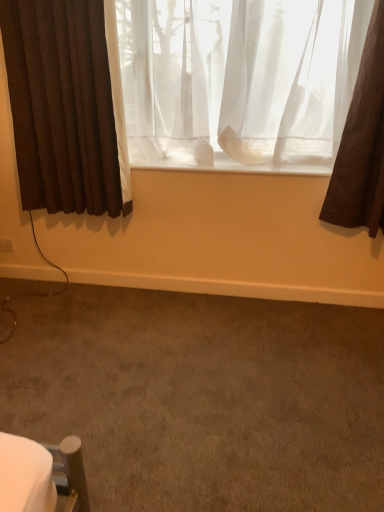
This screenshot has height=512, width=384. Describe the element at coordinates (237, 79) in the screenshot. I see `sheer white curtain at center, which is counted as the 1th curtain, starting from the right` at that location.

Describe the element at coordinates (6, 245) in the screenshot. I see `white plastic electric outlet at lower left` at that location.

You are a GUI agent. You are given a task and a screenshot of the screen. Output one action in this format:
    pyautogui.click(x=<x>, y=<y>)
    Task: Click on the brown carpet at lower center
    The height and width of the screenshot is (512, 384).
    Given the screenshot: What is the action you would take?
    pyautogui.click(x=203, y=398)

What do you see at coordinates (203, 398) in the screenshot? I see `brown carpet at lower center` at bounding box center [203, 398].

This screenshot has height=512, width=384. What are the coordinates of `sheer white curtain at center, placed as the second curtain when sorted from left to right` in the screenshot? It's located at (237, 79).

How different are the orientations of brown carpet at lower center and white plastic electric outlet at lower left in degrees?

The facing directions of brown carpet at lower center and white plastic electric outlet at lower left are 89.6 degrees apart.

Who is more distant, brown carpet at lower center or white plastic electric outlet at lower left?

white plastic electric outlet at lower left is more distant.

Which object is positioned more to the left, brown carpet at lower center or white plastic electric outlet at lower left?

Positioned to the left is white plastic electric outlet at lower left.

From the image's perspective, is brown carpet at lower center located above or below white plastic electric outlet at lower left?

brown carpet at lower center is situated lower than white plastic electric outlet at lower left in the image.

Who is taller, sheer white curtain at center, which is counted as the 1th curtain, starting from the right, or brown carpet at lower center?

sheer white curtain at center, which is counted as the 1th curtain, starting from the right, is taller.

Can we say sheer white curtain at center, which is counted as the 1th curtain, starting from the right, lies outside brown carpet at lower center?

Yes.

Between sheer white curtain at center, which is counted as the 1th curtain, starting from the right, and brown carpet at lower center, which one has larger width?

brown carpet at lower center.

Is brown fabric curtain at left, marked as the 2th curtain in a right-to-left arrangement, smaller than brown carpet at lower center?

Yes, brown fabric curtain at left, marked as the 2th curtain in a right-to-left arrangement, is smaller than brown carpet at lower center.

From the image's perspective, who appears lower, brown fabric curtain at left, arranged as the first curtain when viewed from the left, or brown carpet at lower center?

brown carpet at lower center.

Is brown fabric curtain at left, marked as the 2th curtain in a right-to-left arrangement, aimed at brown carpet at lower center?

No, brown fabric curtain at left, marked as the 2th curtain in a right-to-left arrangement, is not aimed at brown carpet at lower center.

How far apart are brown fabric curtain at left, marked as the 2th curtain in a right-to-left arrangement, and brown carpet at lower center?

A distance of 3.66 feet exists between brown fabric curtain at left, marked as the 2th curtain in a right-to-left arrangement, and brown carpet at lower center.

Is brown fabric curtain at left, marked as the 2th curtain in a right-to-left arrangement, far away from white plastic electric outlet at lower left?

Actually, brown fabric curtain at left, marked as the 2th curtain in a right-to-left arrangement, and white plastic electric outlet at lower left are a little close together.

I want to click on electric outlet located behind the brown fabric curtain at left, arranged as the first curtain when viewed from the left, so click(x=6, y=245).

From a real-world perspective, which is physically below, brown fabric curtain at left, arranged as the first curtain when viewed from the left, or white plastic electric outlet at lower left?

In real-world perspective, white plastic electric outlet at lower left is lower.

From the image's perspective, which one is positioned higher, brown fabric curtain at left, arranged as the first curtain when viewed from the left, or white plastic electric outlet at lower left?

brown fabric curtain at left, arranged as the first curtain when viewed from the left, from the image's perspective.

At what (x,y) coordinates should I click in order to perform the action: click on curtain behind the sheer white curtain at center, placed as the second curtain when sorted from left to right. Please return your answer as a coordinate pair (x, y). The image size is (384, 512). Looking at the image, I should click on (62, 106).

Which is more to the left, sheer white curtain at center, placed as the second curtain when sorted from left to right, or brown fabric curtain at left, arranged as the first curtain when viewed from the left?

Positioned to the left is brown fabric curtain at left, arranged as the first curtain when viewed from the left.

Considering the relative positions of sheer white curtain at center, which is counted as the 1th curtain, starting from the right, and brown fabric curtain at left, arranged as the first curtain when viewed from the left, in the image provided, is sheer white curtain at center, which is counted as the 1th curtain, starting from the right, in front of brown fabric curtain at left, arranged as the first curtain when viewed from the left,?

Yes, the depth of sheer white curtain at center, which is counted as the 1th curtain, starting from the right, is less than that of brown fabric curtain at left, arranged as the first curtain when viewed from the left.

From a real-world perspective, is sheer white curtain at center, which is counted as the 1th curtain, starting from the right, on top of brown fabric curtain at left, marked as the 2th curtain in a right-to-left arrangement?

Yes, from a real-world perspective, sheer white curtain at center, which is counted as the 1th curtain, starting from the right, is over brown fabric curtain at left, marked as the 2th curtain in a right-to-left arrangement

From the image's perspective, is white plastic electric outlet at lower left located above or below brown carpet at lower center?

From the image's perspective, white plastic electric outlet at lower left appears above brown carpet at lower center.

Would you say white plastic electric outlet at lower left is outside brown carpet at lower center?

white plastic electric outlet at lower left is positioned outside brown carpet at lower center.

Is white plastic electric outlet at lower left with brown carpet at lower center?

No, white plastic electric outlet at lower left is not next to brown carpet at lower center.

Relative to brown carpet at lower center, is white plastic electric outlet at lower left in front or behind?

Visually, white plastic electric outlet at lower left is located behind brown carpet at lower center.

Is brown fabric curtain at left, arranged as the first curtain when viewed from the left, inside white plastic electric outlet at lower left?

Definitely not — brown fabric curtain at left, arranged as the first curtain when viewed from the left, is not inside white plastic electric outlet at lower left.

Considering the relative positions of white plastic electric outlet at lower left and brown fabric curtain at left, arranged as the first curtain when viewed from the left, in the image provided, is white plastic electric outlet at lower left to the left or to the right of brown fabric curtain at left, arranged as the first curtain when viewed from the left,?

In the image, white plastic electric outlet at lower left appears on the left side of brown fabric curtain at left, arranged as the first curtain when viewed from the left.

Between white plastic electric outlet at lower left and brown fabric curtain at left, marked as the 2th curtain in a right-to-left arrangement, which one has smaller size?

With smaller size is white plastic electric outlet at lower left.

In order to click on electric outlet on the left of the brown carpet at lower center in this screenshot , I will do `click(6, 245)`.

Where is `plain below the sheer white curtain at center, placed as the second curtain when sorted from left to right (from the image's perspective)`? plain below the sheer white curtain at center, placed as the second curtain when sorted from left to right (from the image's perspective) is located at coordinates (203, 398).

From the picture: From the image, which object appears to be nearer to brown fabric curtain at left, marked as the 2th curtain in a right-to-left arrangement, sheer white curtain at center, which is counted as the 1th curtain, starting from the right, or white plastic electric outlet at lower left?

sheer white curtain at center, which is counted as the 1th curtain, starting from the right, lies closer to brown fabric curtain at left, marked as the 2th curtain in a right-to-left arrangement, than the other object.

Estimate the real-world distances between objects in this image. Which object is further from white plastic electric outlet at lower left, sheer white curtain at center, placed as the second curtain when sorted from left to right, or brown fabric curtain at left, marked as the 2th curtain in a right-to-left arrangement?

Based on the image, sheer white curtain at center, placed as the second curtain when sorted from left to right, appears to be further to white plastic electric outlet at lower left.

When comparing their distances from sheer white curtain at center, placed as the second curtain when sorted from left to right, does brown fabric curtain at left, marked as the 2th curtain in a right-to-left arrangement, or brown carpet at lower center seem closer?

Based on the image, brown fabric curtain at left, marked as the 2th curtain in a right-to-left arrangement, appears to be nearer to sheer white curtain at center, placed as the second curtain when sorted from left to right.

Consider the image. When comparing their distances from white plastic electric outlet at lower left, does brown carpet at lower center or sheer white curtain at center, placed as the second curtain when sorted from left to right, seem further?

sheer white curtain at center, placed as the second curtain when sorted from left to right, is positioned further to the anchor white plastic electric outlet at lower left.

Considering their positions, is white plastic electric outlet at lower left positioned further to brown carpet at lower center than brown fabric curtain at left, marked as the 2th curtain in a right-to-left arrangement?

Based on the image, white plastic electric outlet at lower left appears to be further to brown carpet at lower center.

Looking at the image, which one is located closer to white plastic electric outlet at lower left, brown fabric curtain at left, arranged as the first curtain when viewed from the left, or brown carpet at lower center?

Among the two, brown fabric curtain at left, arranged as the first curtain when viewed from the left, is located nearer to white plastic electric outlet at lower left.

Based on their spatial positions, is brown carpet at lower center or brown fabric curtain at left, arranged as the first curtain when viewed from the left, further from sheer white curtain at center, placed as the second curtain when sorted from left to right?

brown carpet at lower center.

Which object lies further to the anchor point brown fabric curtain at left, marked as the 2th curtain in a right-to-left arrangement, white plastic electric outlet at lower left or brown carpet at lower center?

Based on the image, brown carpet at lower center appears to be further to brown fabric curtain at left, marked as the 2th curtain in a right-to-left arrangement.

This screenshot has height=512, width=384. Identify the location of plain situated between white plastic electric outlet at lower left and sheer white curtain at center, placed as the second curtain when sorted from left to right, from left to right. (203, 398).

What are the coordinates of `curtain between white plastic electric outlet at lower left and sheer white curtain at center, which is counted as the 1th curtain, starting from the right` in the screenshot? It's located at (62, 106).

Locate an element on the screen. This screenshot has height=512, width=384. curtain between sheer white curtain at center, placed as the second curtain when sorted from left to right, and brown carpet at lower center in the up-down direction is located at coordinates (62, 106).